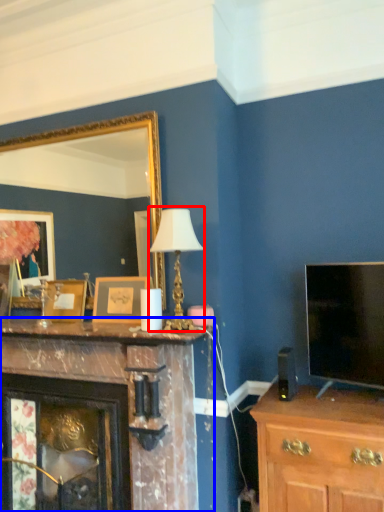
Question: Which point is further to the camera, table lamp (highlighted by a red box) or fireplace (highlighted by a blue box)?

Choices:
 (A) table lamp
 (B) fireplace

Answer: (A)